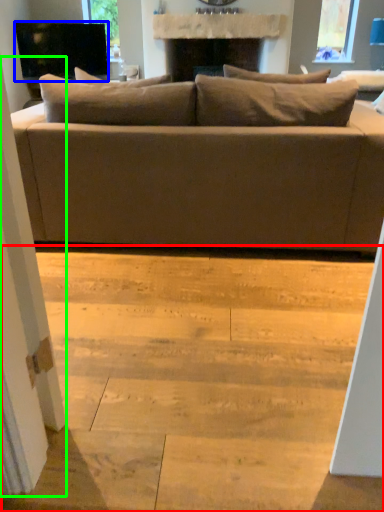
Question: Which object is positioned farthest from stair (highlighted by a red box)? Select from television (highlighted by a blue box) and screen door (highlighted by a green box).

Choices:
 (A) television
 (B) screen door

Answer: (A)